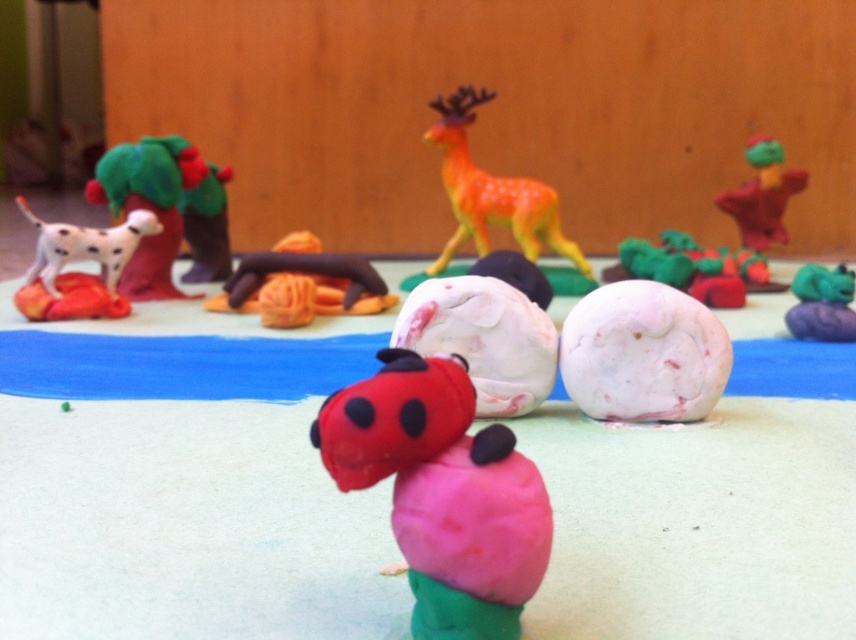
Between point (605, 419) and point (107, 202), which one is positioned behind?

The point (107, 202) is more distant.

Is point (597, 308) farther from camera compared to point (226, 252)?

No, it is not.

Identify the location of white matte ball at center. The image size is (856, 640). 643,353.

Is white marble ball at center taller than white matte dog at left?

In fact, white marble ball at center may be shorter than white matte dog at left.

Does white marble ball at center have a lesser height compared to white matte dog at left?

Yes.

Is point (497, 326) farther from viewer compared to point (34, 276)?

No, it is not.

The height and width of the screenshot is (640, 856). Identify the location of white marble ball at center. (484, 339).

Who is higher up, orange matte deer at center or matte orange dog at left?

Positioned higher is orange matte deer at center.

Describe the element at coordinates (491, 192) in the screenshot. I see `orange matte deer at center` at that location.

Where is `orange matte deer at center`? This screenshot has height=640, width=856. orange matte deer at center is located at coordinates (491, 192).